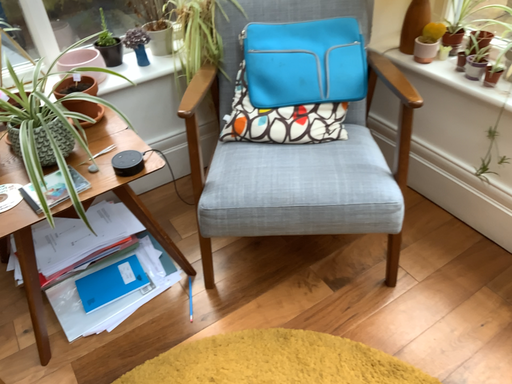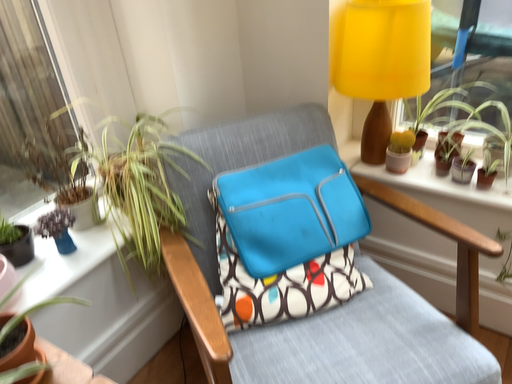
Question: How did the camera likely rotate when shooting the video?

Choices:
 (A) rotated downward
 (B) rotated upward

Answer: (B)